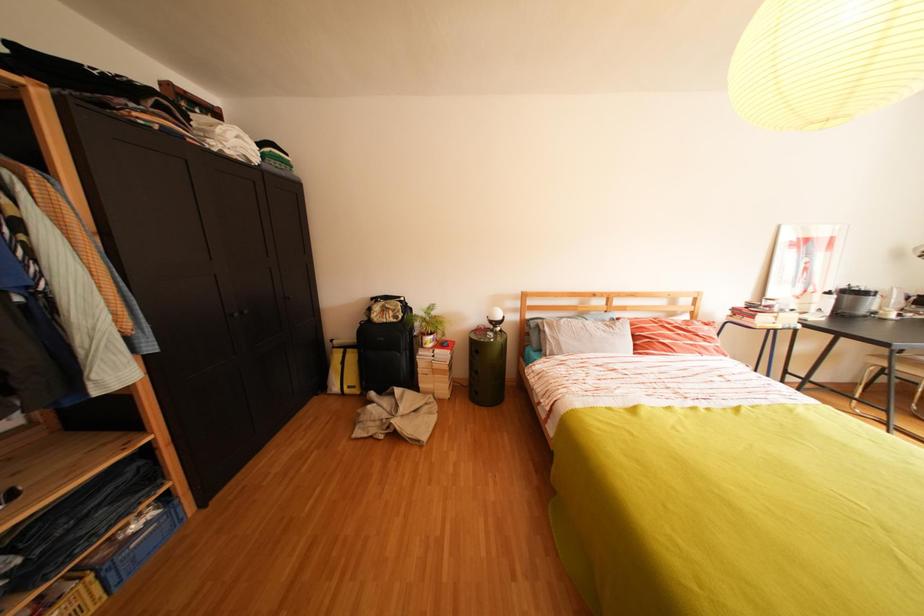
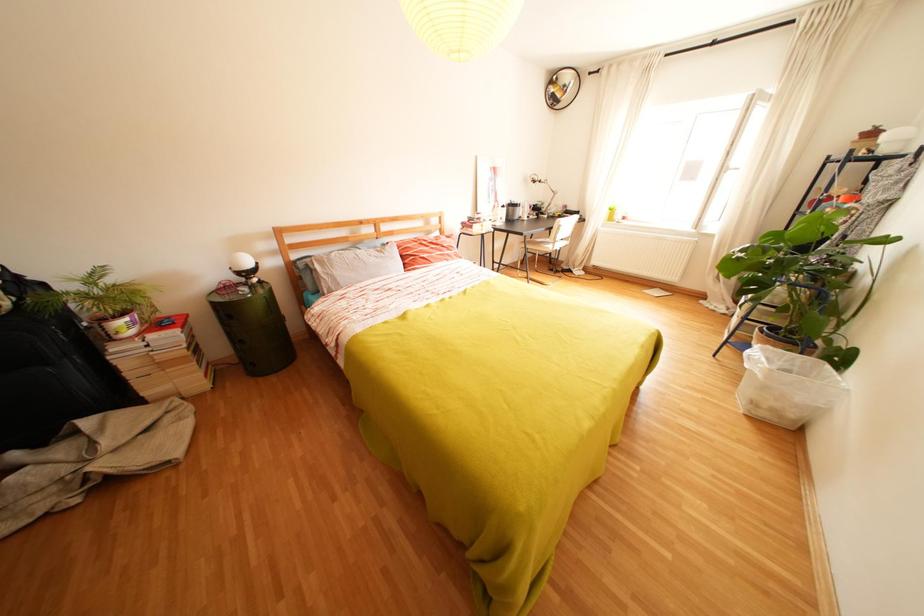
The first image is from the beginning of the video and the second image is from the end. How did the camera likely rotate when shooting the video?

The rotation direction of the camera is right-down.